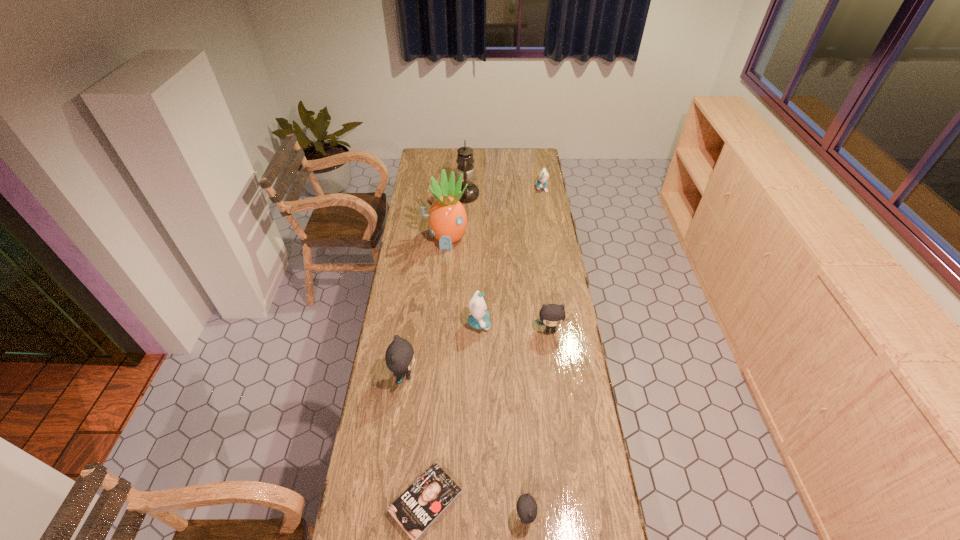
I want to click on free space that is in between the second nearest gray kitten and the farther blue kitten, so click(x=473, y=281).

Locate an element on the screen. The height and width of the screenshot is (540, 960). empty space that is in between the third nearest object and the smaller blue kitten is located at coordinates (473, 281).

Locate an element on the screen. The height and width of the screenshot is (540, 960). vacant space that is in between the sixth object from left to right and the nearer blue kitten is located at coordinates (x=502, y=420).

Find the location of a particular element. The width and height of the screenshot is (960, 540). empty location between the second nearest gray kitten and the oil lamp is located at coordinates (435, 285).

Where is `free space between the orange pineapple and the nearest gray kitten`? Image resolution: width=960 pixels, height=540 pixels. free space between the orange pineapple and the nearest gray kitten is located at coordinates (486, 377).

You are a GUI agent. You are given a task and a screenshot of the screen. Output one action in this format:
    pyautogui.click(x=<x>, y=<y>)
    Task: Click on the free space between the rightmost gray kitten and the oil lamp
    This screenshot has height=540, width=960.
    Given the screenshot: What is the action you would take?
    pyautogui.click(x=508, y=263)

At what (x,y) coordinates should I click in order to perform the action: click on free space between the farther blue kitten and the left blue kitten. Please return your answer as a coordinate pair (x, y). The height and width of the screenshot is (540, 960). Looking at the image, I should click on (511, 255).

Where is `unoccupied area between the oil lamp and the farthest gray kitten`? The image size is (960, 540). unoccupied area between the oil lamp and the farthest gray kitten is located at coordinates (508, 263).

The height and width of the screenshot is (540, 960). Find the location of `vacant space that's between the farther blue kitten and the rightmost gray kitten`. vacant space that's between the farther blue kitten and the rightmost gray kitten is located at coordinates (545, 259).

The width and height of the screenshot is (960, 540). What are the coordinates of `blank region between the pineapple and the left blue kitten` in the screenshot? It's located at (463, 281).